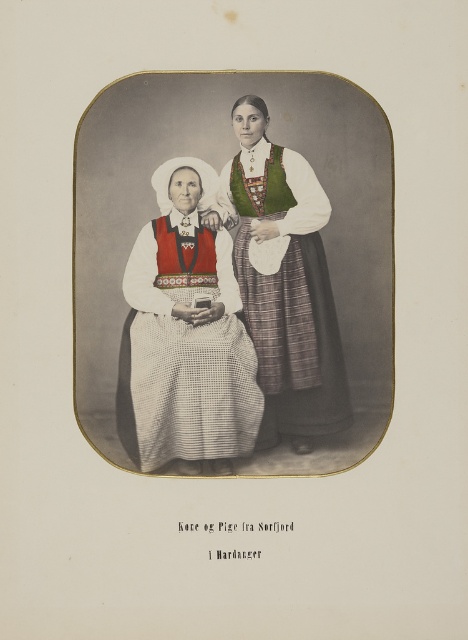
You are standing 15 feet away from the image. The point at coordinates point (256, 433) is located on the individual standing on the right. Can you reach that point with your hand without moving closer to the image?

The distance of point (256, 433) from viewer is 14.71 feet, which is slightly less than 15 feet. Therefore, you can reach that point with your hand without moving closer to the image.

From the picture: You are a photographer trying to take a photo of the knitted fabric dress at left from the camera. Can you capture the entire dress in the frame without moving either the dress or the camera?

The knitted fabric dress at left and camera are 4.44 meters apart. Since the distance between them is 4.44 meters, you can likely capture the entire dress in the frame without moving either, as standard camera lenses can accommodate such distances for framing.

You are an art conservator examining this vintage photograph. You notice two points marked in the image. The first point is at coordinates point (160, 195) and the second at point (289, 371). Which of these points is closer to the camera lens?

Point (160, 195) is closer to the camera lens than point (289, 371).